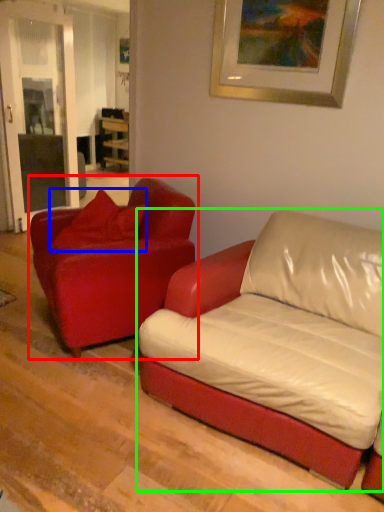
Question: Based on their relative distances, which object is farther from studio couch (highlighted by a red box)? Choose from pillow (highlighted by a blue box) and studio couch (highlighted by a green box).

Choices:
 (A) pillow
 (B) studio couch

Answer: (B)